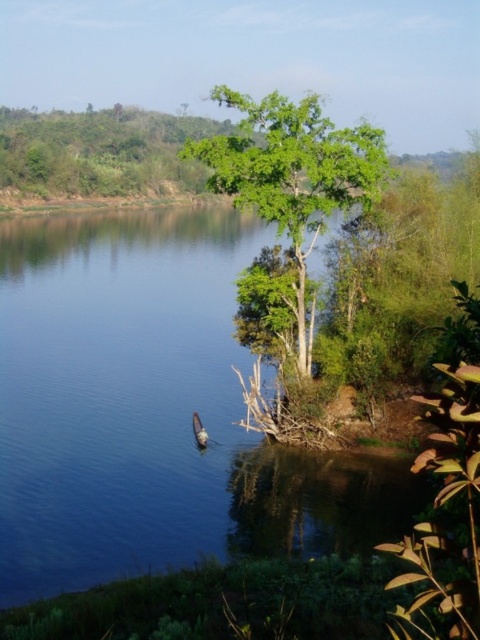
Question: Is blue smooth water at center to the left of green leafy tree at center from the viewer's perspective?

Choices:
 (A) no
 (B) yes

Answer: (B)

Question: Which point is farther to the camera?

Choices:
 (A) (x=301, y=353)
 (B) (x=68, y=422)

Answer: (B)

Question: Does blue smooth water at center come behind green leafy tree at center?

Choices:
 (A) yes
 (B) no

Answer: (B)

Question: Among these points, which one is nearest to the camera?

Choices:
 (A) (148, 237)
 (B) (360, 198)

Answer: (B)

Question: Does blue smooth water at center have a smaller size compared to green leafy tree at center?

Choices:
 (A) yes
 (B) no

Answer: (B)